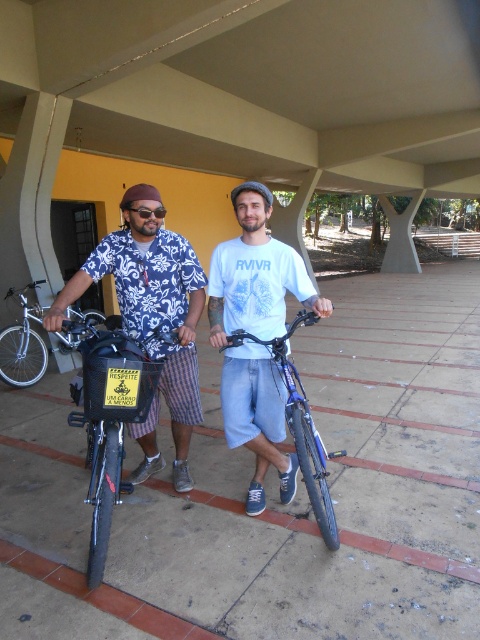
Is black matte bicycle at left to the right of silver metallic bicycle at left from the viewer's perspective?

Correct, you'll find black matte bicycle at left to the right of silver metallic bicycle at left.

Identify the location of black matte bicycle at left. This screenshot has height=640, width=480. (111, 420).

Does point (34, 333) come farther from viewer compared to point (133, 211)?

Yes.

Is silver metallic bicycle at left behind transparent plastic goggles at center?

That is True.

Locate an element on the screen. The image size is (480, 640). silver metallic bicycle at left is located at coordinates tap(24, 342).

I want to click on silver metallic bicycle at left, so click(24, 342).

Does blue metallic bicycle at center appear on the right side of silver metallic bicycle at left?

Indeed, blue metallic bicycle at center is positioned on the right side of silver metallic bicycle at left.

Is blue metallic bicycle at center to the left of silver metallic bicycle at left from the viewer's perspective?

No, blue metallic bicycle at center is not to the left of silver metallic bicycle at left.

The image size is (480, 640). What do you see at coordinates (300, 426) in the screenshot?
I see `blue metallic bicycle at center` at bounding box center [300, 426].

Identify the location of blue metallic bicycle at center. (300, 426).